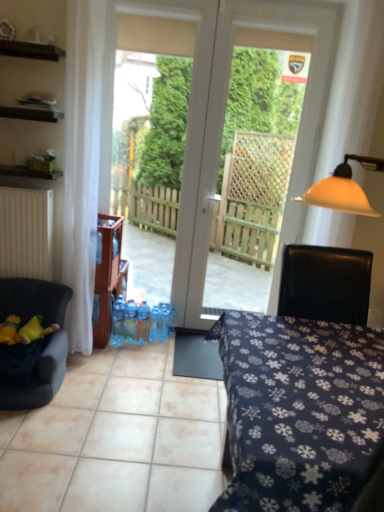
Find the location of a particular element. vacant area that is in front of wooden cabinet at left is located at coordinates click(x=107, y=358).